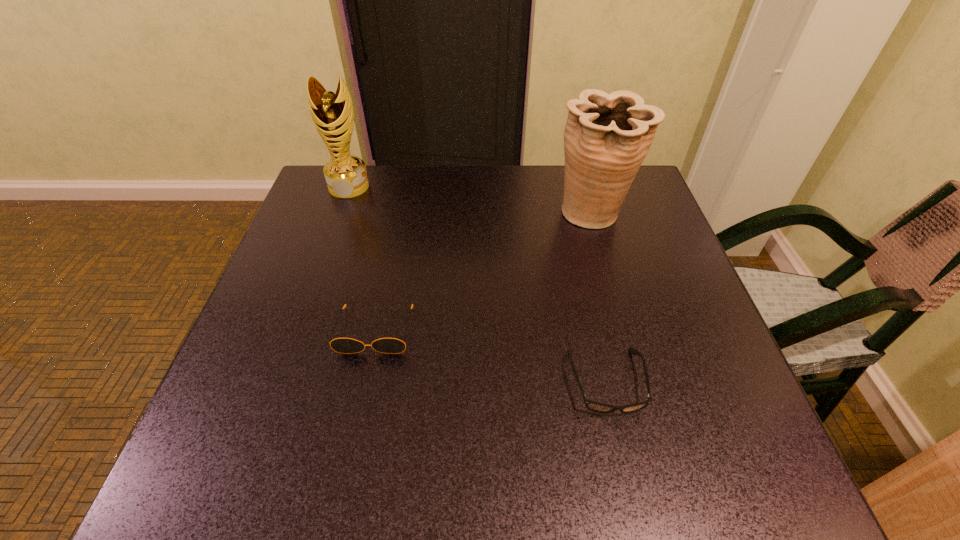
Identify the location of the leftmost object. This screenshot has height=540, width=960. (332, 113).

Identify the location of urn. This screenshot has width=960, height=540. (607, 136).

Identify the location of sunglasses. (341, 345).

Locate an element on the screen. The image size is (960, 540). the second object from left to right is located at coordinates (341, 345).

At what (x,y) coordinates should I click in order to perform the action: click on the shortest object. Please return your answer as a coordinate pair (x, y). Looking at the image, I should click on (594, 406).

You are a GUI agent. You are given a task and a screenshot of the screen. Output one action in this format:
    pyautogui.click(x=<x>, y=<y>)
    Task: Click on the free region located 0.250m on the front-facing side of the award
    
    Given the screenshot: What is the action you would take?
    pyautogui.click(x=321, y=265)

The height and width of the screenshot is (540, 960). I want to click on vacant area situated 0.160m on the left of the urn, so click(x=490, y=213).

Where is `vacant space located on the front-facing side of the second shortest object`? The image size is (960, 540). vacant space located on the front-facing side of the second shortest object is located at coordinates (364, 384).

Find the location of a particular element. free space located on the front-facing side of the shortest object is located at coordinates (626, 467).

What are the coordinates of `award that is at the far edge` in the screenshot? It's located at (332, 113).